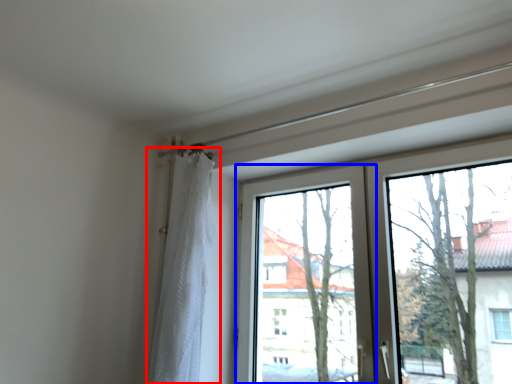
Question: Which of the following is the closest to the observer, curtain (highlighted by a red box) or window screen (highlighted by a blue box)?

Choices:
 (A) curtain
 (B) window screen

Answer: (B)